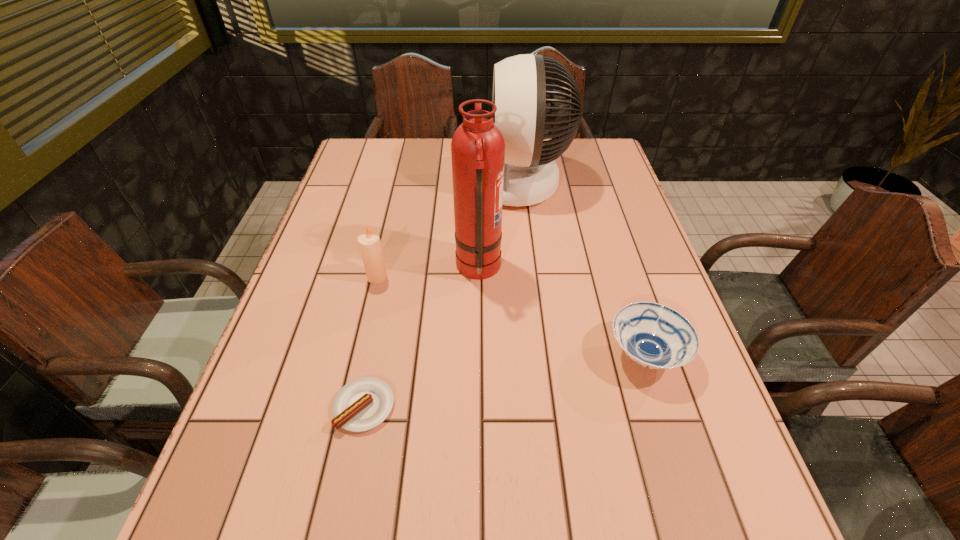
I want to click on vacant area situated on the front of the soup bowl, so click(675, 446).

Find the location of a particular element. The image size is (960, 540). free region located on the front of the sausage is located at coordinates click(x=348, y=488).

Identify the location of object at the far edge. (525, 112).

Image resolution: width=960 pixels, height=540 pixels. Find the location of `candle that is positioned at the left edge`. candle that is positioned at the left edge is located at coordinates (370, 247).

Where is `sausage present at the left edge`? This screenshot has height=540, width=960. sausage present at the left edge is located at coordinates (364, 403).

The image size is (960, 540). Identify the location of object that is at the right edge. (655, 336).

The image size is (960, 540). In the image, there is a desktop. Identify the location of vacant space at the far edge. (444, 139).

What are the coordinates of `free space at the left edge of the desktop` in the screenshot? It's located at (346, 298).

Image resolution: width=960 pixels, height=540 pixels. In the image, there is a desktop. What are the coordinates of `vacant space at the right edge` in the screenshot? It's located at (585, 208).

Locate an element on the screen. The image size is (960, 540). free space at the far left corner is located at coordinates tap(366, 167).